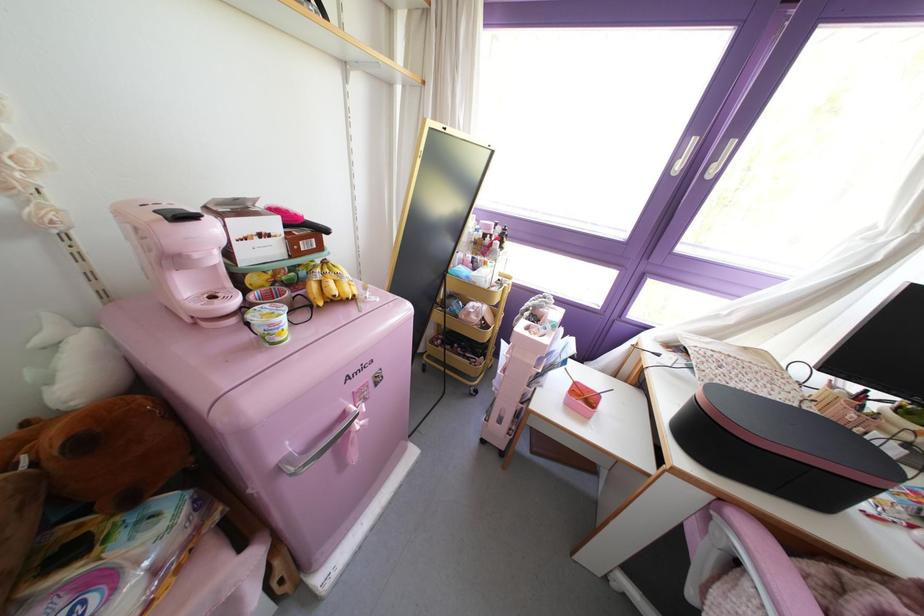
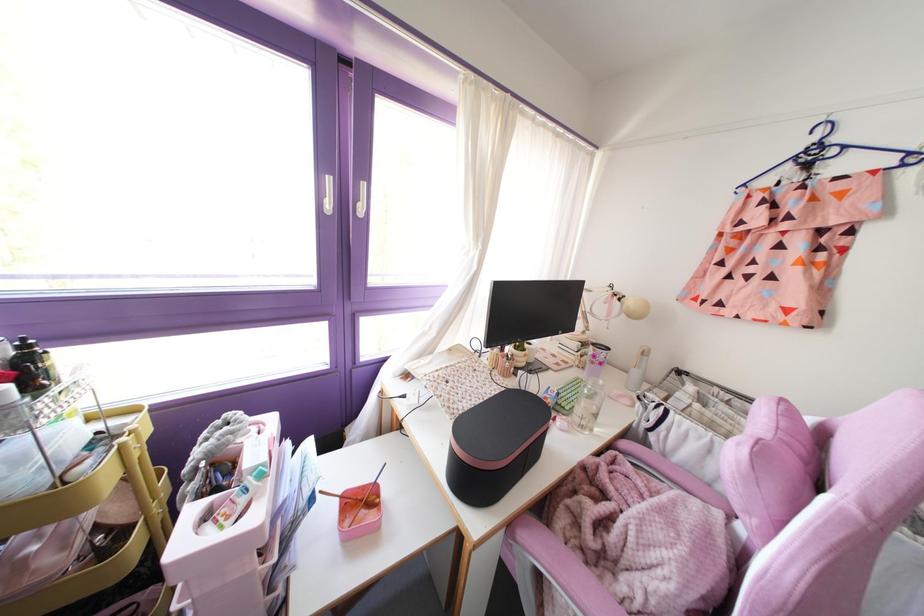
Find the pixel in the second image that matches [677,167] in the first image.

(329, 205)